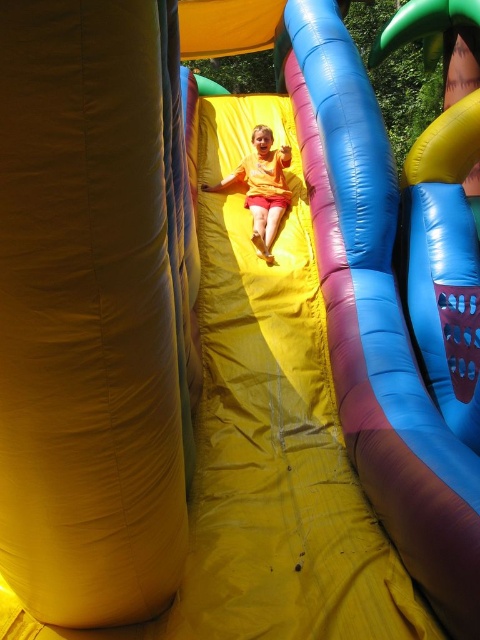
You are a parent trying to ensure your child stays safe while playing on the yellow fabric slide at center and the yellow matte shorts at center. Based on their heights, which object should you monitor more closely for potential safety issues?

The yellow fabric slide at center is taller than the yellow matte shorts at center, so you should monitor the yellow fabric slide at center more closely for potential safety issues due to its greater height.

You are a safety inspector checking the distance between the yellow fabric slide at center and the yellow matte shorts at center. According to safety regulations, the minimum distance required between any two objects in a play area is 80 centimeters. Is the current distance compliant with the regulation?

The yellow fabric slide at center and yellow matte shorts at center are 81.01 centimeters apart, which exceeds the minimum required distance of 80 centimeters. Therefore, the current distance is compliant with the safety regulations.

You are standing at the point marked as point [370,376] in the image. What object is directly in front of you?

The yellow fabric slide at center is directly in front of you at point [370,376].